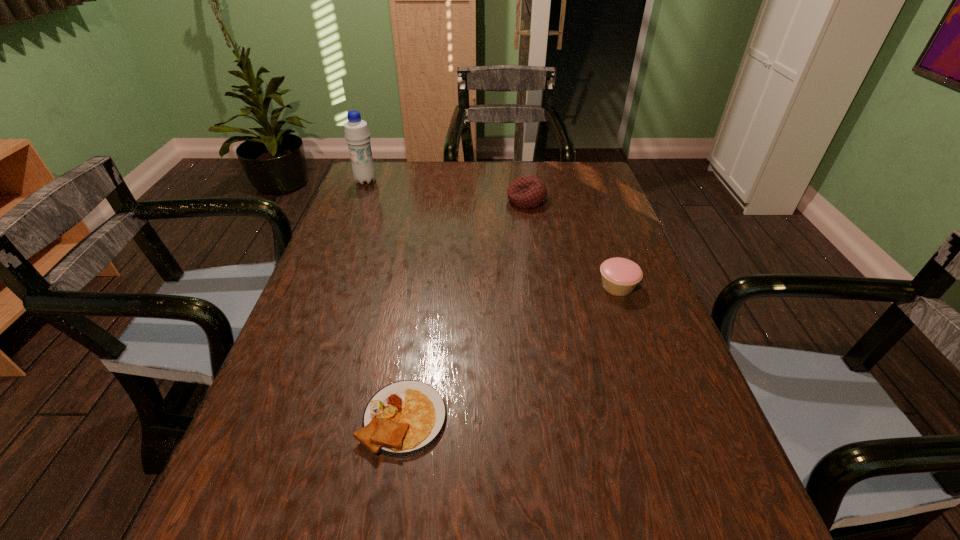
Locate an element on the screen. The image size is (960, 540). the farthest object is located at coordinates (357, 135).

I want to click on water bottle, so click(357, 135).

The height and width of the screenshot is (540, 960). Find the location of `the third nearest object`. the third nearest object is located at coordinates (526, 192).

Image resolution: width=960 pixels, height=540 pixels. What are the coordinates of `the second object from right to left` in the screenshot? It's located at (526, 192).

Locate an element on the screen. This screenshot has width=960, height=540. the third tallest object is located at coordinates (620, 276).

What are the coordinates of `the rightmost object` in the screenshot? It's located at (620, 276).

At what (x,y) coordinates should I click in order to perform the action: click on the nearest object. Please return your answer as a coordinate pair (x, y). This screenshot has width=960, height=540. Looking at the image, I should click on (404, 418).

I want to click on omelet, so click(x=404, y=418).

Find the location of a particular element. vacant space located 0.360m on the right of the tallest object is located at coordinates (486, 181).

Find the location of `free space located on the left of the second farthest object`. free space located on the left of the second farthest object is located at coordinates (385, 200).